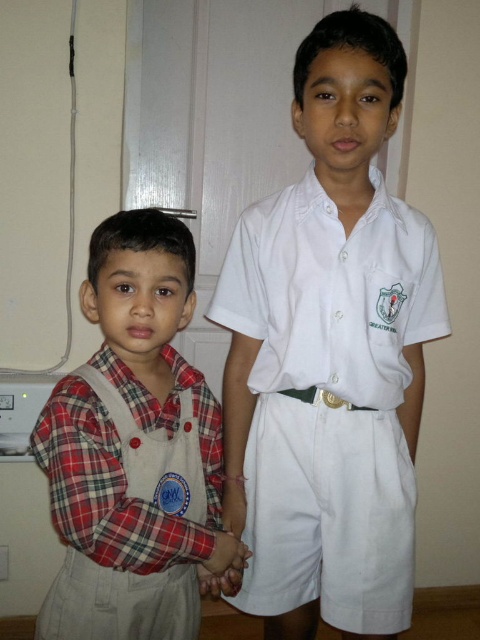
Question: Which of the following is the farthest from the observer?

Choices:
 (A) white cotton shirt at center
 (B) plaid fabric shirt at left

Answer: (A)

Question: In this image, where is white cotton shirt at center located relative to plaid fabric shirt at left?

Choices:
 (A) above
 (B) below

Answer: (A)

Question: Among these points, which one is nearest to the camera?

Choices:
 (A) (33, 444)
 (B) (364, 77)

Answer: (A)

Question: Does white cotton shirt at center appear on the left side of plaid fabric shirt at left?

Choices:
 (A) yes
 (B) no

Answer: (B)

Question: Is white cotton shirt at center positioned behind plaid fabric shirt at left?

Choices:
 (A) yes
 (B) no

Answer: (A)